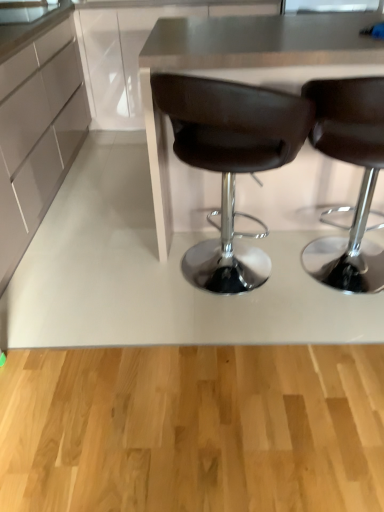
Question: From their relative heights in the image, would you say brown leather chair at center, which is the 1th chair from right to left, is taller or shorter than matte white cabinet at left?

Choices:
 (A) tall
 (B) short

Answer: (B)

Question: Is point (301, 258) closer or farther from the camera than point (33, 218)?

Choices:
 (A) farther
 (B) closer

Answer: (A)

Question: Considering the real-world distances, which object is farthest from the metallic gray table at center?

Choices:
 (A) brown leather chair at center, placed as the 2th chair when sorted from left to right
 (B) matte white cabinet at left
 (C) brown leather chair at center, placed as the first chair when sorted from left to right

Answer: (B)

Question: Which of these objects is positioned farthest from the metallic gray table at center?

Choices:
 (A) brown leather chair at center, which is the 1th chair from right to left
 (B) matte white cabinet at left
 (C) brown leather chair at center, placed as the first chair when sorted from left to right

Answer: (B)